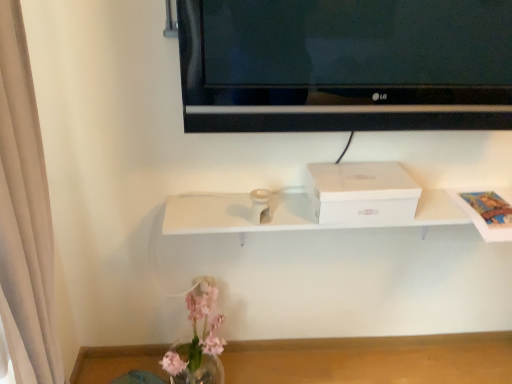
Question: Does white cardboard box at center have a greater height compared to transparent glass vase at lower center?

Choices:
 (A) yes
 (B) no

Answer: (A)

Question: Is white cardboard box at center positioned far away from transparent glass vase at lower center?

Choices:
 (A) no
 (B) yes

Answer: (A)

Question: Is white cardboard box at center outside of transparent glass vase at lower center?

Choices:
 (A) no
 (B) yes

Answer: (B)

Question: From a real-world perspective, does white cardboard box at center sit lower than transparent glass vase at lower center?

Choices:
 (A) yes
 (B) no

Answer: (B)

Question: From the image's perspective, does white cardboard box at center appear higher than transparent glass vase at lower center?

Choices:
 (A) yes
 (B) no

Answer: (A)

Question: Would you say translucent glass vase at lower left is inside or outside black glossy tv at upper center?

Choices:
 (A) outside
 (B) inside

Answer: (A)

Question: Based on their sizes in the image, would you say translucent glass vase at lower left is bigger or smaller than black glossy tv at upper center?

Choices:
 (A) small
 (B) big

Answer: (B)

Question: Is translucent glass vase at lower left taller or shorter than black glossy tv at upper center?

Choices:
 (A) tall
 (B) short

Answer: (A)

Question: Does point click(194, 299) appear closer or farther from the camera than point click(350, 66)?

Choices:
 (A) farther
 (B) closer

Answer: (A)

Question: Is transparent glass vase at lower center wider or thinner than white cardboard box at center?

Choices:
 (A) wide
 (B) thin

Answer: (A)

Question: Considering their positions, is transparent glass vase at lower center located in front of or behind white cardboard box at center?

Choices:
 (A) behind
 (B) front

Answer: (A)

Question: Considering the positions of point (268, 365) and point (336, 198), is point (268, 365) closer or farther from the camera than point (336, 198)?

Choices:
 (A) farther
 (B) closer

Answer: (A)

Question: From a real-world perspective, is transparent glass vase at lower center physically located above or below white cardboard box at center?

Choices:
 (A) below
 (B) above

Answer: (A)

Question: Is point (481, 347) closer or farther from the camera than point (195, 301)?

Choices:
 (A) farther
 (B) closer

Answer: (A)

Question: From the image's perspective, is transparent glass vase at lower center above or below translucent glass vase at lower left?

Choices:
 (A) above
 (B) below

Answer: (B)